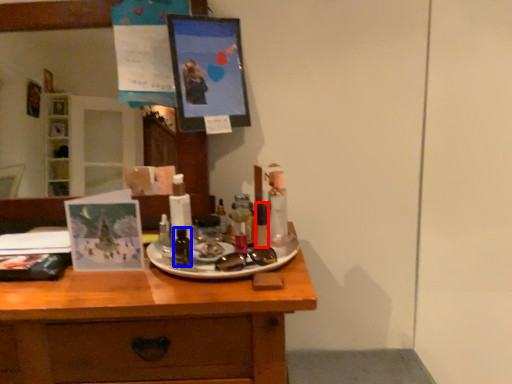
Question: Which object is further to the camera taking this photo, toiletry (highlighted by a red box) or toiletry (highlighted by a blue box)?

Choices:
 (A) toiletry
 (B) toiletry

Answer: (A)